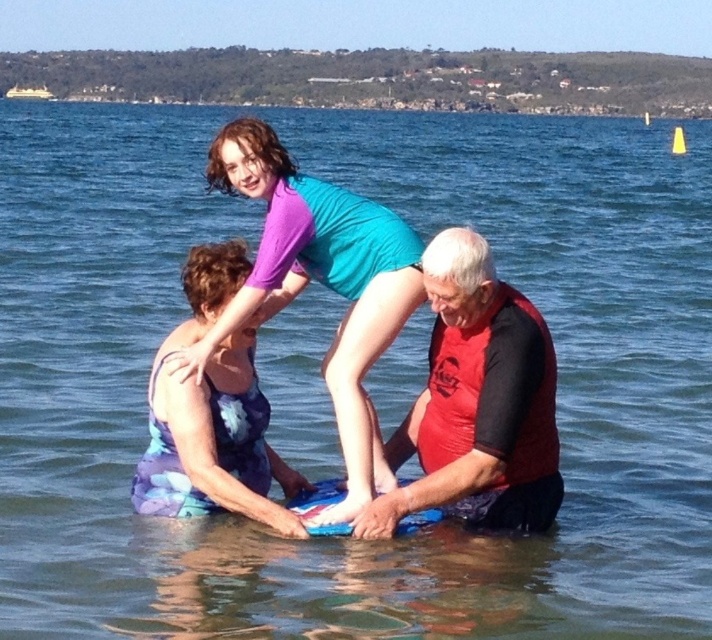
You are a photographer standing on the shore observing the scene. You need to capture a photo that includes both the red matte wetsuit at center and the matte purple swimsuit at center. Which one should you focus on first to ensure both are in the frame?

The red matte wetsuit at center is positioned under the matte purple swimsuit at center, so you should focus on the matte purple swimsuit at center first to ensure both are in the frame.

You are a photographer trying to capture a candid shot of the two purple outfits in the scene. The matte purple swimsuit at center and the purple fabric dress at lower left are part of your focus. Given that your camera has a maximum focus range of 4 feet, will you be able to capture both subjects in sharp focus without moving your position?

The matte purple swimsuit at center and the purple fabric dress at lower left are 4.45 feet apart. Since the distance between them exceeds the camera maximum focus range of 4 feet, you will not be able to capture both subjects in sharp focus without moving closer or adjusting your position.

You are a photographer trying to capture a group photo of the red matte wetsuit at center and the purple fabric dress at lower left. You want to ensure both subjects are fully visible in the frame. Based on their sizes, which subject might require more space in the photo composition?

The red matte wetsuit at center might be wider than the purple fabric dress at lower left, so it might require more space in the photo composition to ensure it is fully visible.